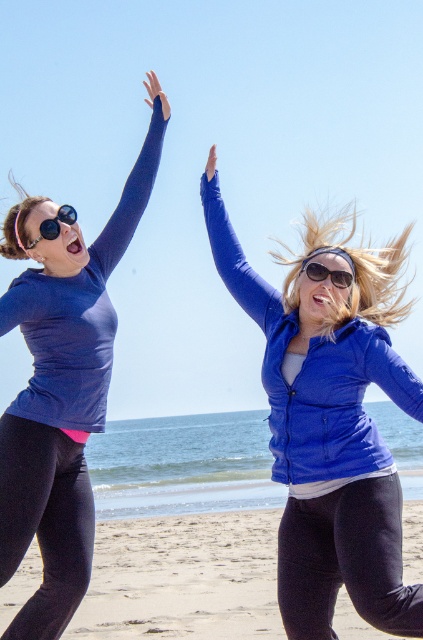
Which is behind, point (114, 225) or point (337, 269)?

The point (114, 225) is behind.

Consider the image. Who is taller, matte blue arm at upper left or sunglasses at center?

Standing taller between the two is matte blue arm at upper left.

At what (x,y) coordinates should I click in order to perform the action: click on matte blue arm at upper left. Please return your answer as a coordinate pair (x, y). Looking at the image, I should click on (132, 188).

Is point (354, 282) farther from camera compared to point (62, 368)?

No, it is in front of (62, 368).

Does blue shiny jacket at center appear over matte blue shirt at left?

No.

Locate an element on the screen. blue shiny jacket at center is located at coordinates 323,440.

Does sandy beach at lower center appear on the left side of matte blue jacket at upper center?

Correct, you'll find sandy beach at lower center to the left of matte blue jacket at upper center.

Does sandy beach at lower center appear under matte blue jacket at upper center?

Indeed, sandy beach at lower center is positioned under matte blue jacket at upper center.

Is point (142, 522) positioned before point (401, 364)?

No, (142, 522) is further to viewer.

Where is `sandy beach at lower center`? sandy beach at lower center is located at coordinates (183, 579).